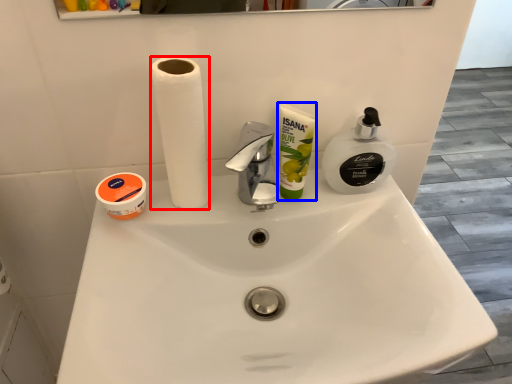
Question: Which of the following is the farthest to the observer, paper towel (highlighted by a red box) or product (highlighted by a blue box)?

Choices:
 (A) paper towel
 (B) product

Answer: (B)